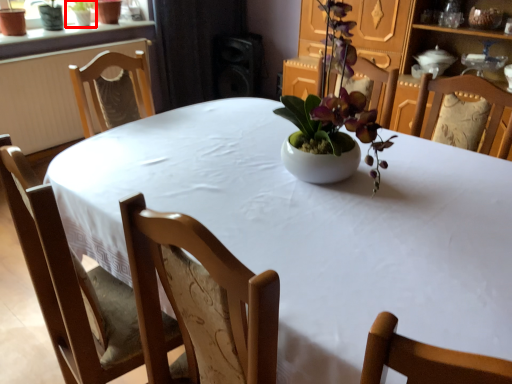
Question: From the image's perspective, what is the correct spatial relationship of houseplant (annotated by the red box) in relation to speaker?

Choices:
 (A) below
 (B) above

Answer: (B)